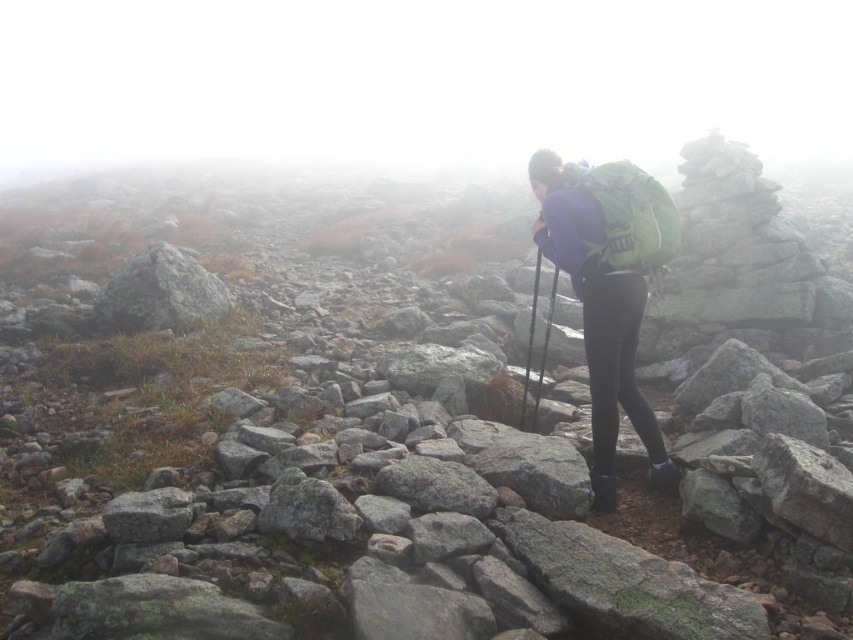
Is matte purple jacket at center below gray rough rock at left?

Indeed, matte purple jacket at center is positioned under gray rough rock at left.

Which is below, matte purple jacket at center or gray rough rock at left?

matte purple jacket at center is below.

Is point (572, 198) less distant than point (126, 316)?

Yes, it is in front of point (126, 316).

I want to click on matte purple jacket at center, so click(608, 289).